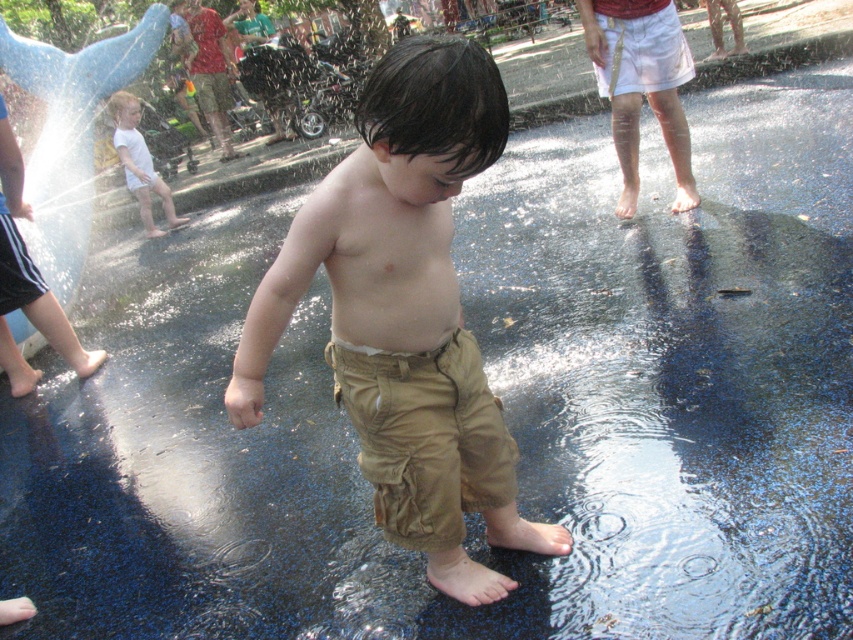
You are a parent trying to dress your child for the water play area. You have two options from the image available to choose from. Which item of clothing is narrower between the khaki cotton pants at center and the white cotton shirt at left?

The khaki cotton pants at center is narrower than the white cotton shirt at left, so you should choose the khaki cotton pants at center if you want a narrower option.

You are a parent trying to dress your child for the water play area. You have two options from the image, the khaki cotton pants at center and the white cotton shirt at left. Which clothing item would be more appropriate to cover the lower body?

The khaki cotton pants at center would be more appropriate to cover the lower body since they are designed for that purpose, while the white cotton shirt at left is meant for the upper body.